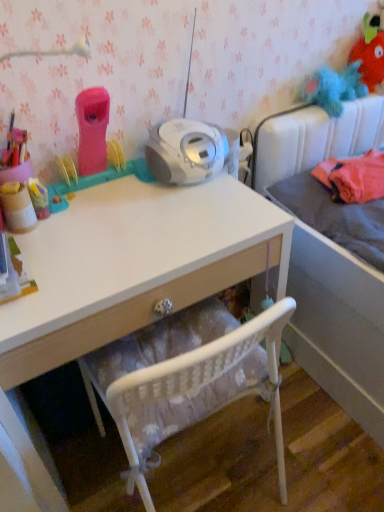
Identify the location of vacant area that is in front of matte brown jar at left, which appears as the third toy when viewed from the back. (53, 268).